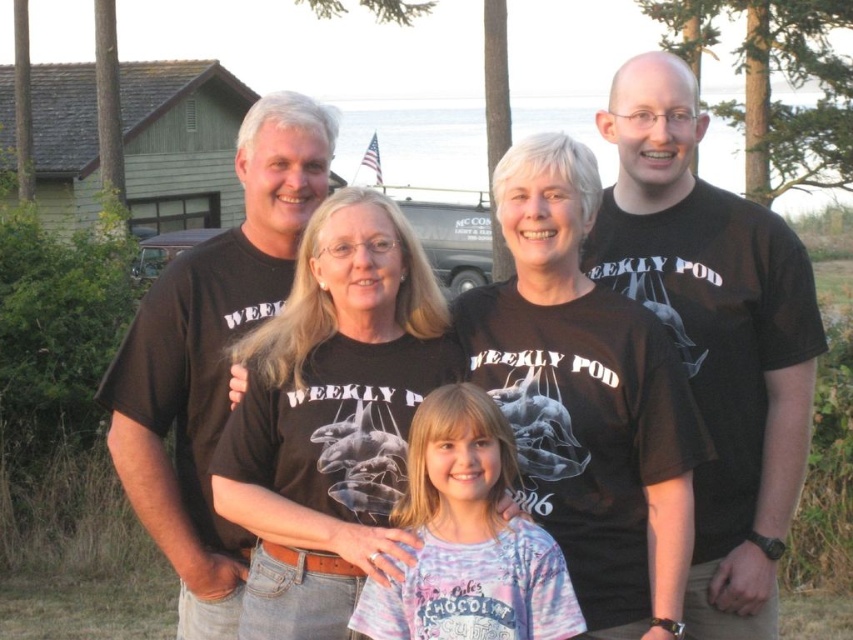
You are standing at the position of the group and want to walk towards the point marked as point (265, 352). Is this point closer to you than the point marked as point (120, 401)?

Point (265, 352) is in front of point (120, 401), so yes, it is closer to you than the other point.